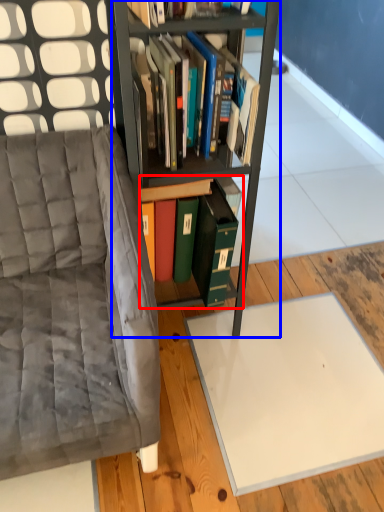
Question: Among these objects, which one is nearest to the camera, book (highlighted by a red box) or bookcase (highlighted by a blue box)?

Choices:
 (A) book
 (B) bookcase

Answer: (B)